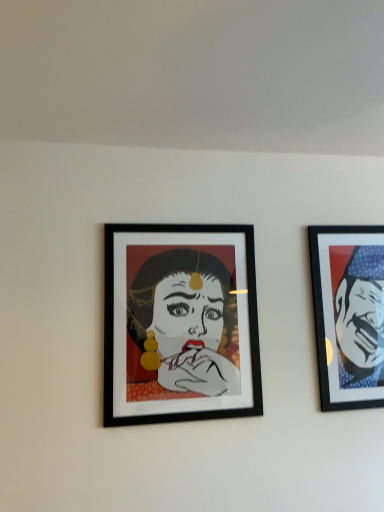
Where is `black glossy picture frame at right`? This screenshot has height=512, width=384. black glossy picture frame at right is located at coordinates (349, 314).

This screenshot has height=512, width=384. What do you see at coordinates (349, 314) in the screenshot?
I see `black glossy picture frame at right` at bounding box center [349, 314].

Locate an element on the screen. The image size is (384, 512). black glossy picture frame at right is located at coordinates [349, 314].